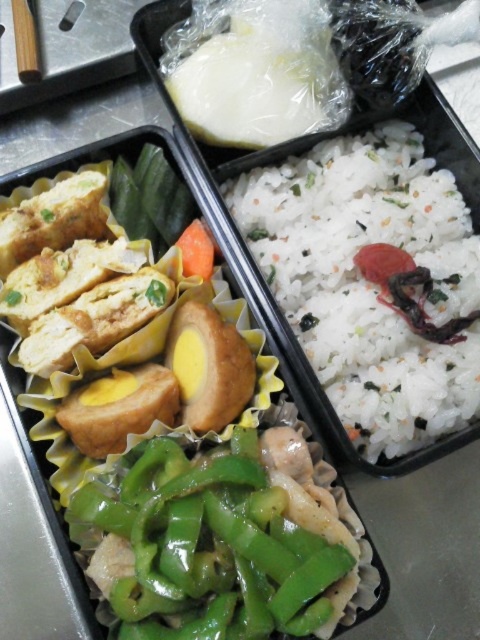
Is white matte rice at center to the right of green glossy bell pepper at center from the viewer's perspective?

Yes, white matte rice at center is to the right of green glossy bell pepper at center.

Which of these two, white matte rice at center or green glossy bell pepper at center, stands taller?

With more height is white matte rice at center.

Who is more distant from viewer, (370,193) or (288,616)?

Positioned behind is point (370,193).

You are a GUI agent. You are given a task and a screenshot of the screen. Output one action in this format:
    pyautogui.click(x=<x>, y=<y>)
    Task: Click on the white matte rice at center
    This screenshot has height=640, width=480.
    Given the screenshot: What is the action you would take?
    pyautogui.click(x=369, y=282)